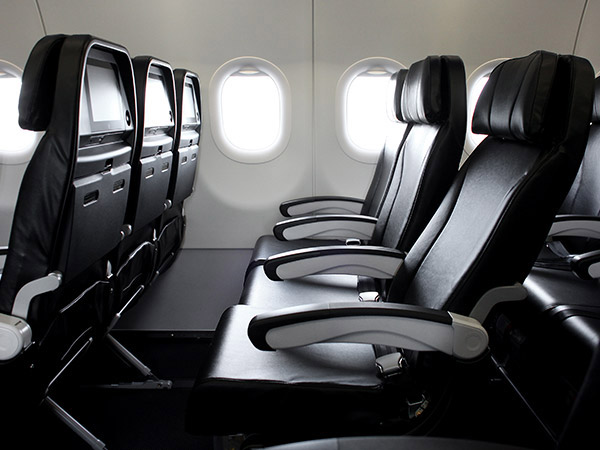
This screenshot has width=600, height=450. I want to click on windows, so click(x=2, y=105), click(x=246, y=134), click(x=367, y=121), click(x=477, y=94).